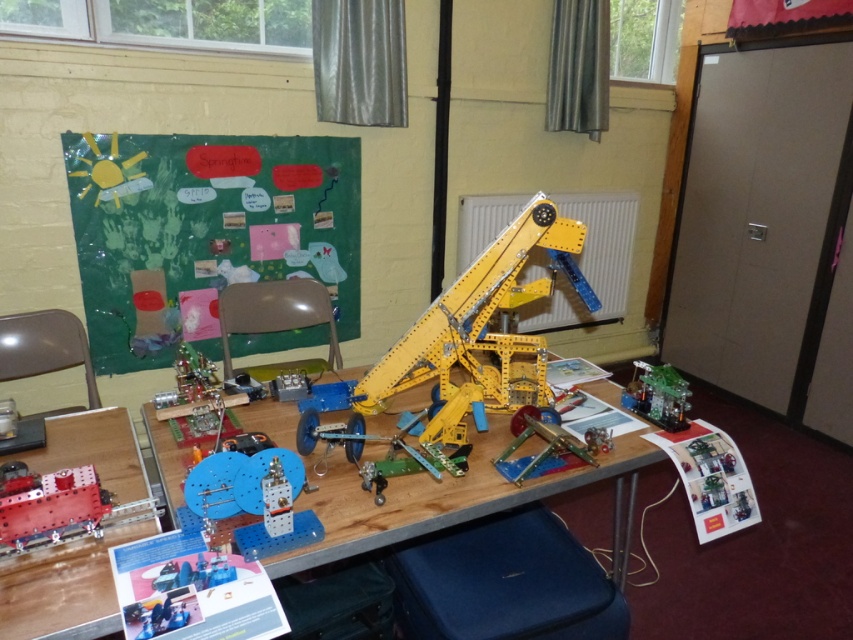
You are a student trying to reach the metallic red cannon at lower left during the science fair. The yellow plastic table at center is blocking your path. Can you move around the table to access the cannon?

The yellow plastic table at center is positioned over metallic red cannon at lower left, meaning the table is directly above the cannon. Since tables are solid structures, you cannot move around or under it to access the cannon. You would need to ask an organizer to move the table or find another way to reach the cannon.